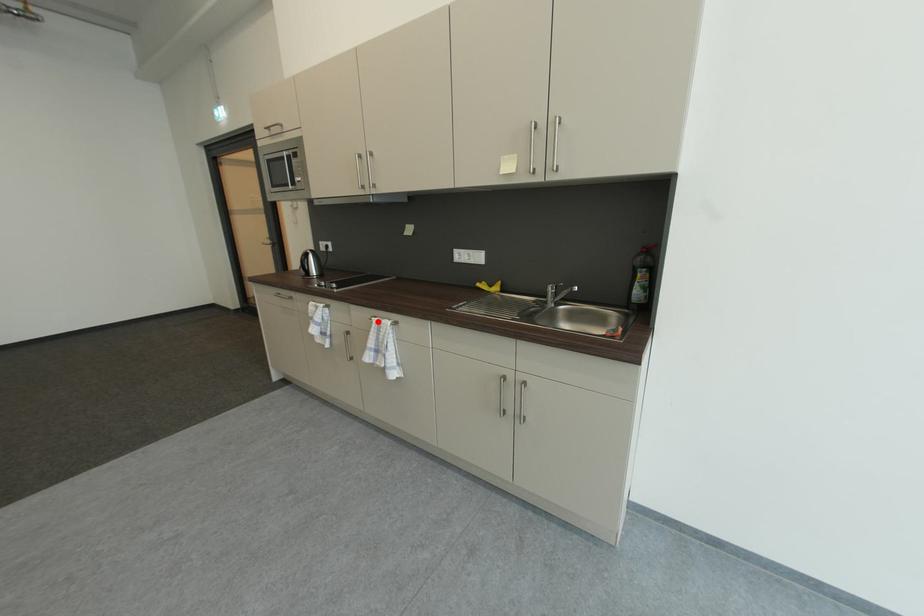
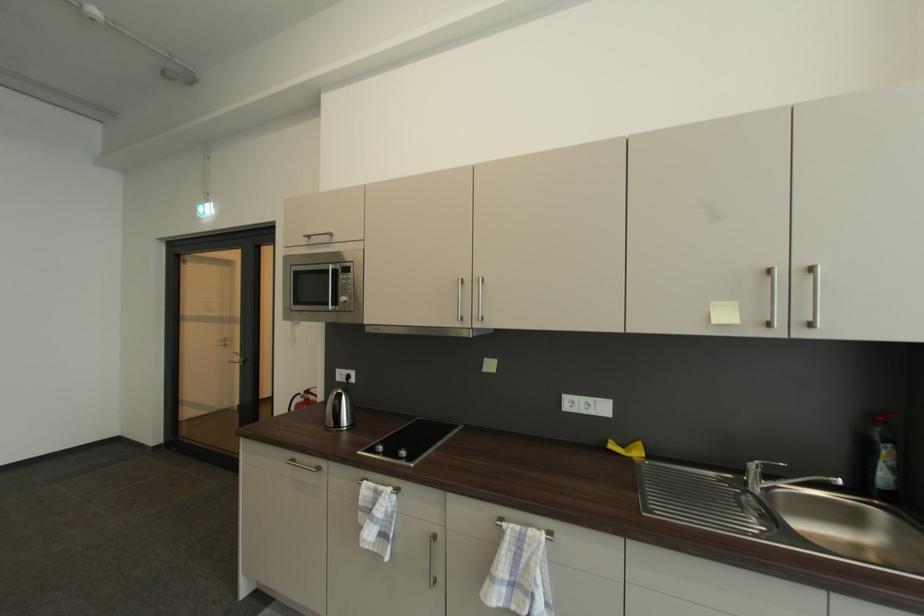
In the second image, find the point that corresponds to the highlighted location in the first image.

(507, 529)